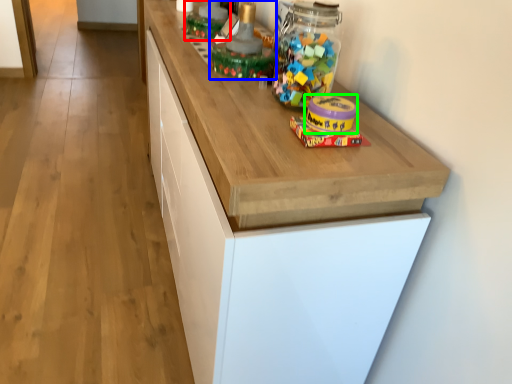
Question: Considering the real-world distances, which object is closest to toy (highlighted by a red box)? toy (highlighted by a blue box) or toy (highlighted by a green box).

Choices:
 (A) toy
 (B) toy

Answer: (A)